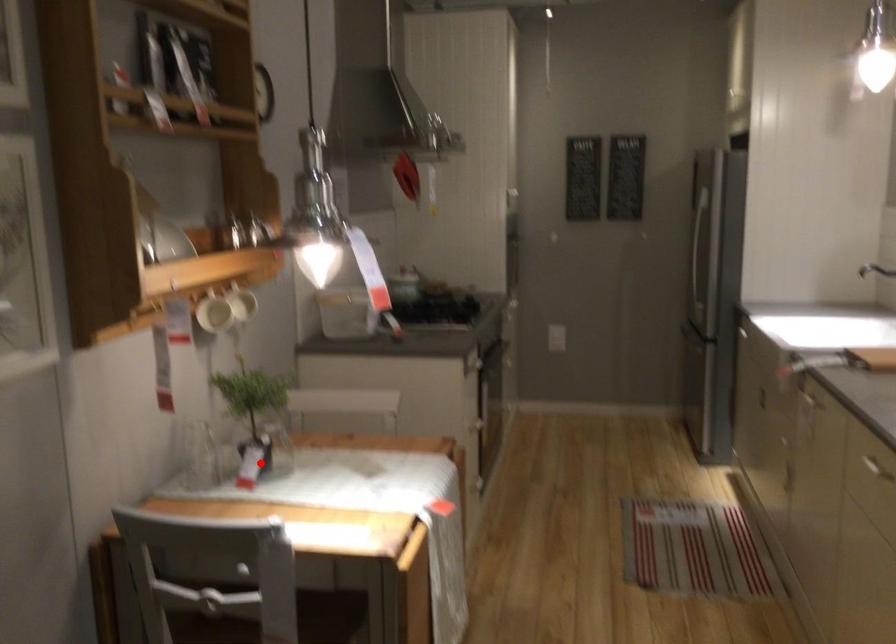
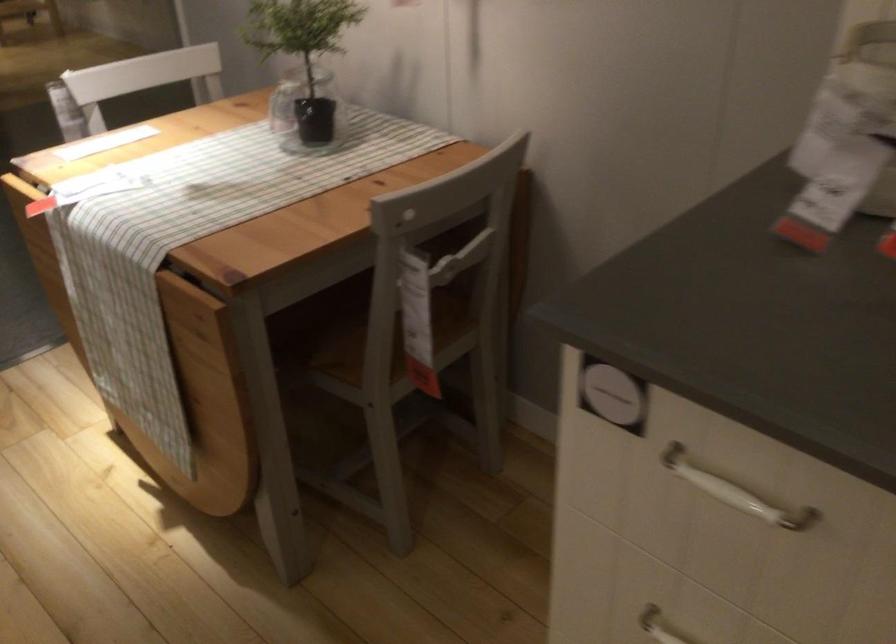
Locate, in the second image, the point that corresponds to the highlighted location in the first image.

(307, 111)